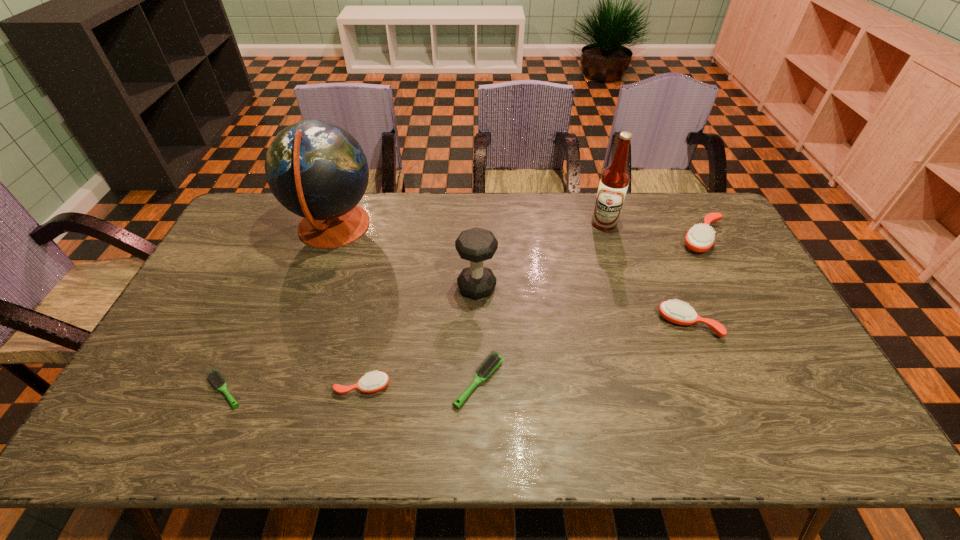
Find the location of a particular element. This screenshot has width=960, height=540. globe is located at coordinates (317, 170).

Locate an element on the screen. This screenshot has height=540, width=960. red alcohol is located at coordinates (614, 181).

At what (x,y) coordinates should I click in order to perform the action: click on the sixth object from left to right. Please return your answer as a coordinate pair (x, y). This screenshot has width=960, height=540. Looking at the image, I should click on (614, 181).

At what (x,y) coordinates should I click in order to perform the action: click on dumbbell. Please return your answer as a coordinate pair (x, y). The height and width of the screenshot is (540, 960). Looking at the image, I should click on (476, 245).

In order to click on gray dumbbell in this screenshot , I will do `click(476, 245)`.

Identify the location of the rightmost hairbrush. Image resolution: width=960 pixels, height=540 pixels. (700, 238).

You are a GUI agent. You are given a task and a screenshot of the screen. Output one action in this format:
    pyautogui.click(x=<x>, y=<y>)
    Task: Click on the rightmost object
    
    Given the screenshot: What is the action you would take?
    pyautogui.click(x=700, y=238)

The image size is (960, 540). In order to click on the second orange hairbrush from left to right in this screenshot , I will do `click(676, 312)`.

Locate an element on the screen. The height and width of the screenshot is (540, 960). the fifth farthest object is located at coordinates (676, 312).

Where is `the smallest orange hairbrush`? The width and height of the screenshot is (960, 540). the smallest orange hairbrush is located at coordinates (372, 382).